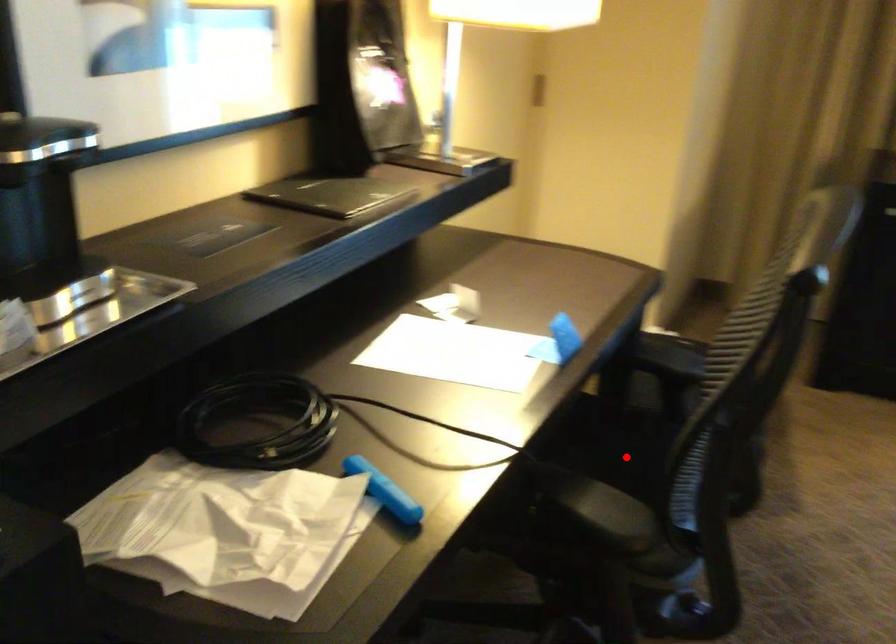
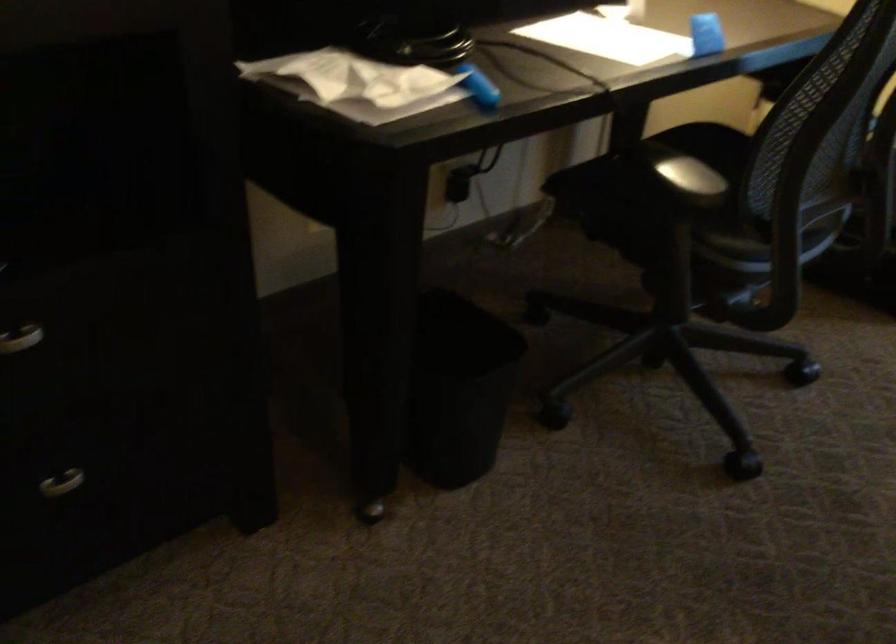
Question: I am providing you with two images of the same scene from different viewpoints. A red point is marked on the first image. Can you still see the location of the red point in image 2?

Choices:
 (A) Yes
 (B) No

Answer: (B)